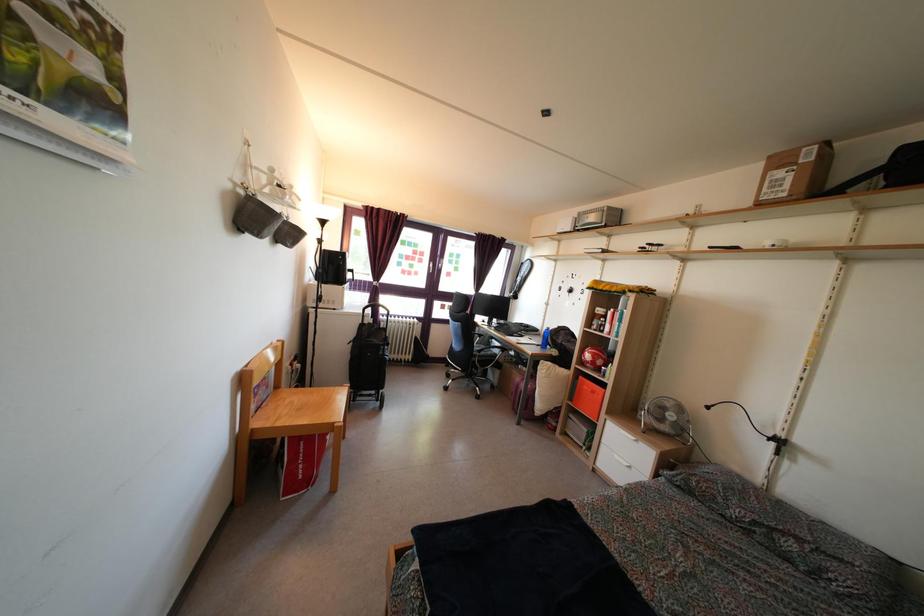
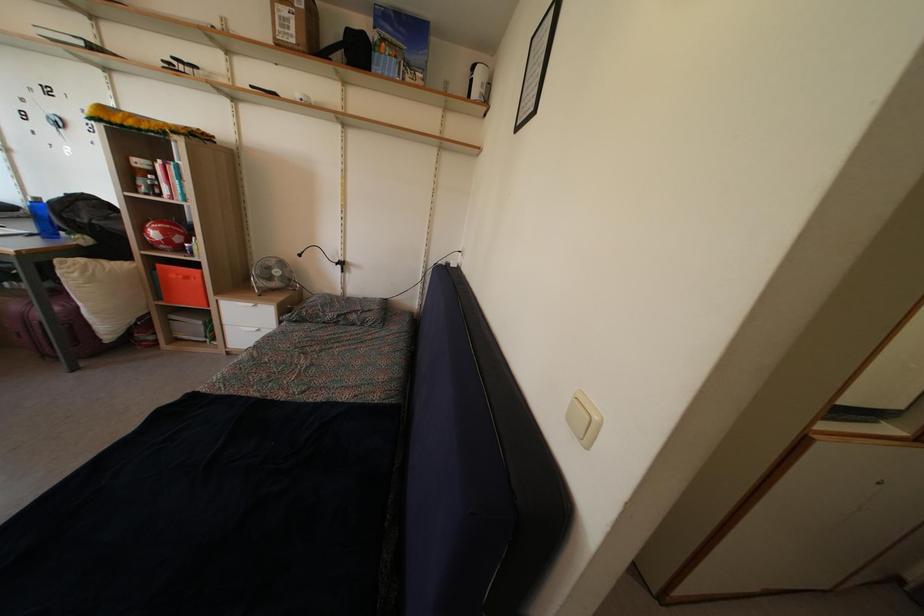
The point at (596, 400) is marked in the first image. Where is the corresponding point in the second image?

(189, 286)